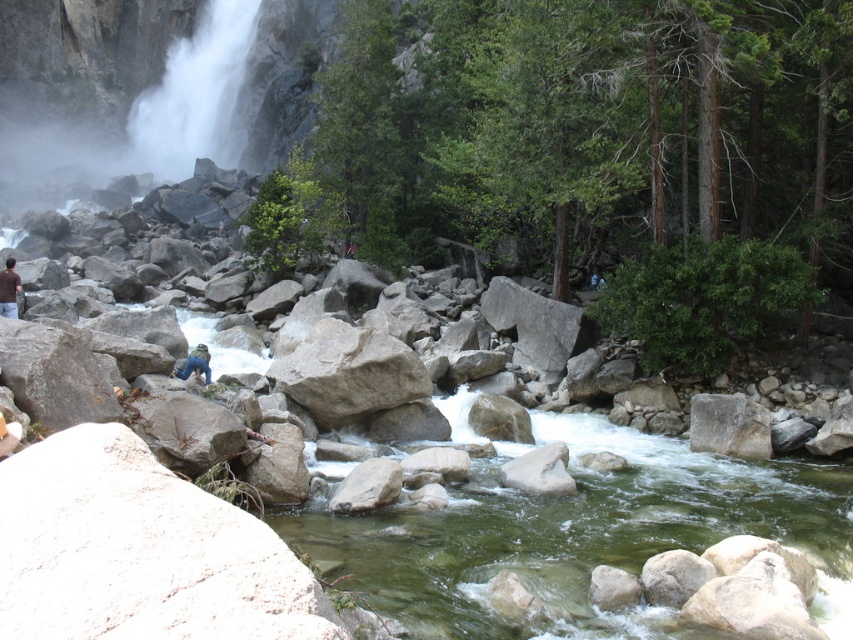
You are standing at the edge of the river and see two points marked in the scene. Which point, point (396, 570) or point (184, 371), is closer to you?

Point (396, 570) is closer to the viewer than point (184, 371).

You are standing at the point closer to the waterfall in the scene. Which point are you at, point (10, 269) or point (180, 371)?

You are at point (180, 371) because it is in front of point (10, 269), which means you are closer to the waterfall.

You are a hiker who has just arrived at the rocky riverbed scene. You notice the brown fabric shirt at lower left and the blue fabric pants at center. Which item is closer to you?

The brown fabric shirt at lower left is closer to you because it is further to the viewer than the blue fabric pants at center.